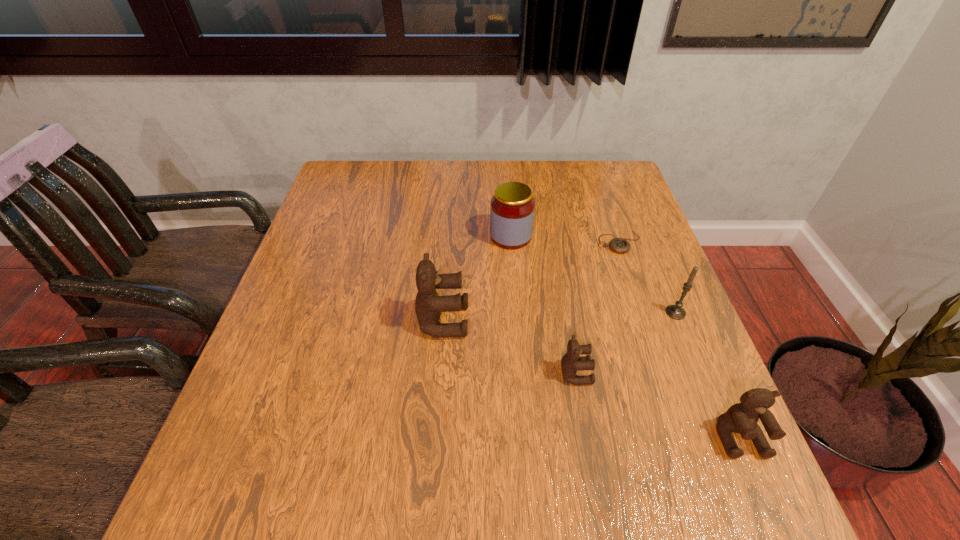
Where is `unoccupied area between the second object from left to right and the candle`? The width and height of the screenshot is (960, 540). unoccupied area between the second object from left to right and the candle is located at coordinates (593, 274).

Locate an element on the screen. The height and width of the screenshot is (540, 960). free space between the shortest teddy bear and the fifth object from right to left is located at coordinates (x=543, y=305).

At what (x,y) coordinates should I click in order to perform the action: click on vacant area that lies between the shortest object and the second shortest teddy bear. Please return your answer as a coordinate pair (x, y). This screenshot has width=960, height=540. Looking at the image, I should click on point(680,340).

Identify which object is located as the nearest to the farthest teddy bear. Please provide its 2D coordinates. Your answer should be formatted as a tuple, i.e. [(x, y)], where the tuple contains the x and y coordinates of a point satisfying the conditions above.

[(512, 208)]

What are the coordinates of `the third closest object to the pocket watch` in the screenshot? It's located at (571, 362).

The height and width of the screenshot is (540, 960). Find the location of `teddy bear that can be found as the closest to the shortest object`. teddy bear that can be found as the closest to the shortest object is located at coordinates (571, 362).

The height and width of the screenshot is (540, 960). I want to click on teddy bear that stands as the second closest to the candle, so click(x=742, y=418).

The height and width of the screenshot is (540, 960). I want to click on free space in the image that satisfies the following two spatial constraints: 1. on the front side of the pocket watch; 2. on the left side of the jar, so click(x=512, y=242).